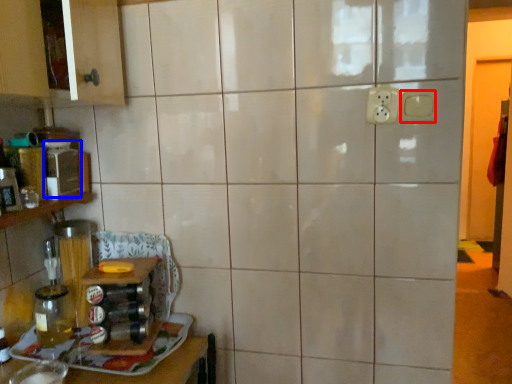
Question: Which point is closer to the camera, electric outlet (highlighted by a red box) or appliance (highlighted by a blue box)?

Choices:
 (A) electric outlet
 (B) appliance

Answer: (A)